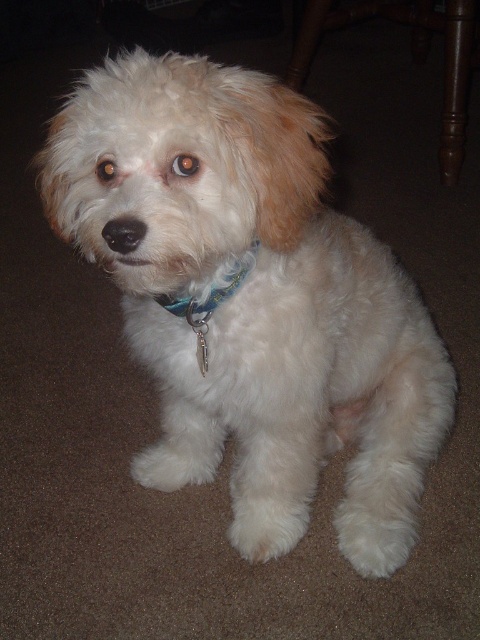
Is white fluffy dog at center shorter than blue fabric collar at center?

Incorrect, white fluffy dog at center's height does not fall short of blue fabric collar at center's.

Which is in front, point (39, 189) or point (160, 301)?

Positioned in front is point (160, 301).

Is point (182, 124) closer to camera compared to point (183, 292)?

Yes, point (182, 124) is in front of point (183, 292).

The height and width of the screenshot is (640, 480). Identify the location of white fluffy dog at center. pos(252,300).